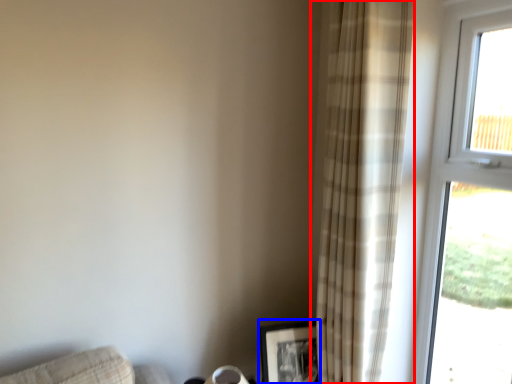
Question: Which point is closer to the camera, curtain (highlighted by a red box) or picture frame (highlighted by a blue box)?

Choices:
 (A) curtain
 (B) picture frame

Answer: (A)